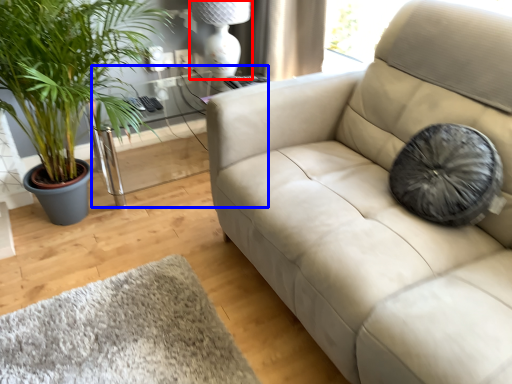
Question: Which object appears farthest to the camera in this image, lamp (highlighted by a red box) or table (highlighted by a blue box)?

Choices:
 (A) lamp
 (B) table

Answer: (A)